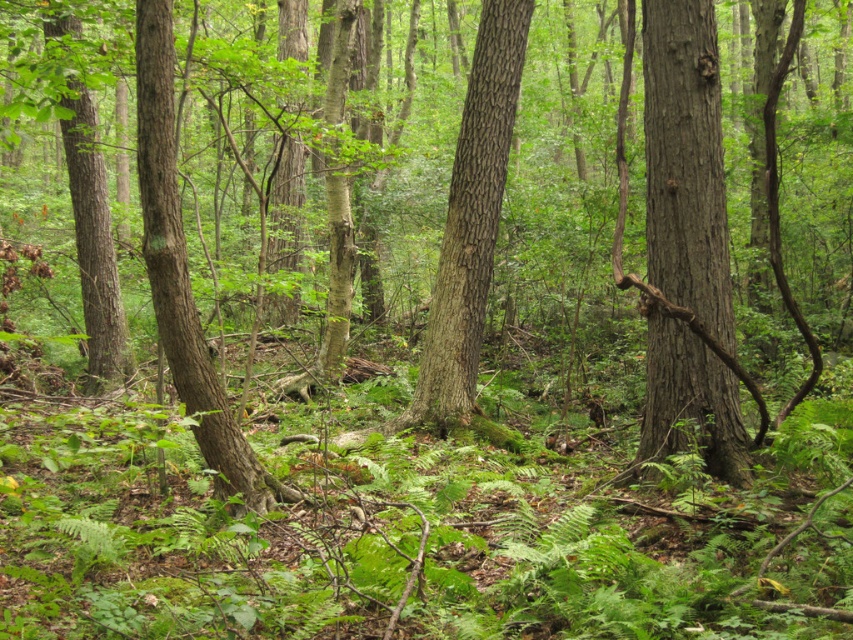
Question: In this image, where is smooth bark tree at center located relative to rough bark tree at left?

Choices:
 (A) left
 (B) right

Answer: (B)

Question: Which point is closer to the camera?

Choices:
 (A) smooth brown tree trunk at center
 (B) rough bark tree at left
 (C) smooth bark tree at center

Answer: (B)

Question: Which point is farther to the camera?

Choices:
 (A) (x=247, y=502)
 (B) (x=447, y=236)

Answer: (B)

Question: Estimate the real-world distances between objects in this image. Which object is farther from the smooth bark tree at center?

Choices:
 (A) smooth brown tree trunk at center
 (B) rough bark tree at left

Answer: (B)

Question: Is smooth brown tree trunk at center bigger than smooth bark tree at center?

Choices:
 (A) yes
 (B) no

Answer: (B)

Question: Where is smooth bark tree at center located in relation to rough bark tree at left in the image?

Choices:
 (A) above
 (B) below

Answer: (A)